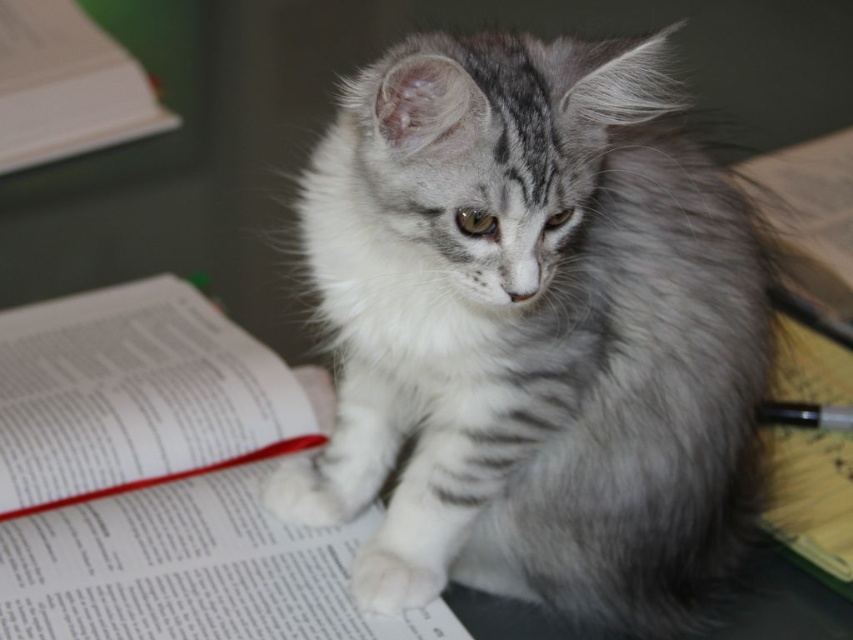
Question: Can you confirm if white paper book at center is thinner than yellow paper notebook at lower right?

Choices:
 (A) no
 (B) yes

Answer: (A)

Question: Which point appears closest to the camera in this image?

Choices:
 (A) (227, 531)
 (B) (430, 179)

Answer: (B)

Question: Which of the following is the farthest from the observer?

Choices:
 (A) white paper book at upper left
 (B) white paper book at center
 (C) yellow paper notebook at lower right
 (D) fuzzy gray cat at center

Answer: (A)

Question: Is fuzzy gray cat at center bigger than white paper book at upper left?

Choices:
 (A) no
 (B) yes

Answer: (B)

Question: Which of the following is the closest to the observer?

Choices:
 (A) coord(816,397)
 (B) coord(32,468)
 (C) coord(527,36)

Answer: (C)

Question: Can you confirm if fuzzy gray cat at center is positioned to the right of yellow paper notebook at lower right?

Choices:
 (A) yes
 (B) no

Answer: (B)